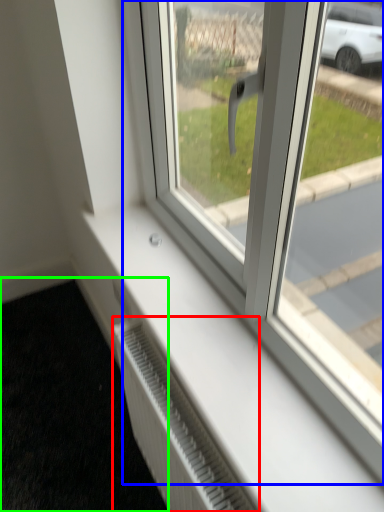
Question: Based on their relative distances, which object is nearer to radiator (highlighted by a red box)? Choose from window (highlighted by a blue box) and pavement (highlighted by a green box).

Choices:
 (A) window
 (B) pavement

Answer: (A)